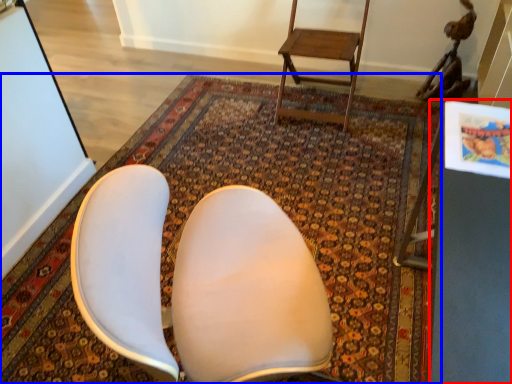
Question: Which object is closer to the camera taking this photo, table (highlighted by a red box) or mat (highlighted by a blue box)?

Choices:
 (A) table
 (B) mat

Answer: (A)